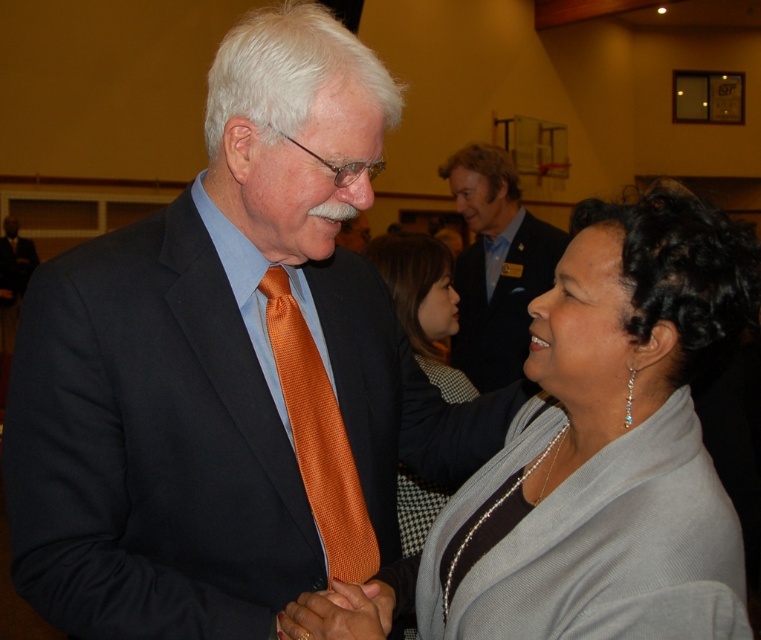
Question: Can you confirm if matte black suit at center is positioned above matte gray sweater at center?

Choices:
 (A) no
 (B) yes

Answer: (B)

Question: Considering the relative positions of blue textured suit at upper center and smooth orange tie at center in the image provided, where is blue textured suit at upper center located with respect to smooth orange tie at center?

Choices:
 (A) above
 (B) below

Answer: (A)

Question: Which point is closer to the camera taking this photo?

Choices:
 (A) (376, 490)
 (B) (470, 154)
 (C) (387, 621)

Answer: (C)

Question: Based on their relative distances, which object is nearer to the blue textured suit at upper center?

Choices:
 (A) smooth orange tie at center
 (B) matte black suit at center
 (C) orange satin tie at center
 (D) matte gray sweater at center

Answer: (B)

Question: Does matte black suit at center lie behind blue textured suit at upper center?

Choices:
 (A) no
 (B) yes

Answer: (A)

Question: Which object is closer to the camera taking this photo?

Choices:
 (A) orange satin tie at center
 (B) blue textured suit at upper center
 (C) matte black suit at center
 (D) smooth orange tie at center

Answer: (D)